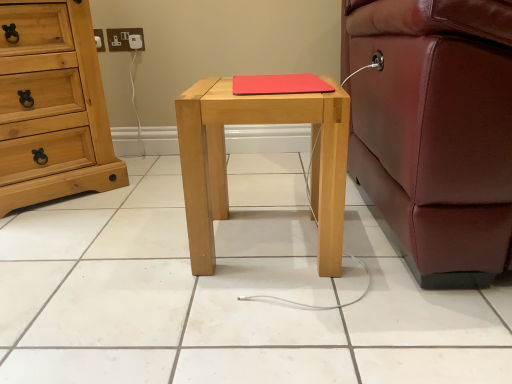
Where is `free point to the right of light brown wooden chest of drawers at left`? free point to the right of light brown wooden chest of drawers at left is located at coordinates (144, 187).